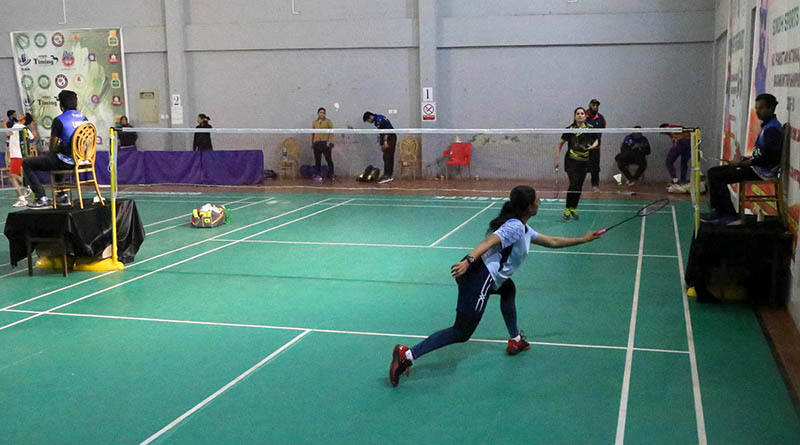
At what (x,y) coordinates should I click in order to perform the action: click on red chair. Please return your answer as a coordinate pair (x, y). The image size is (800, 445). Looking at the image, I should click on (456, 151).